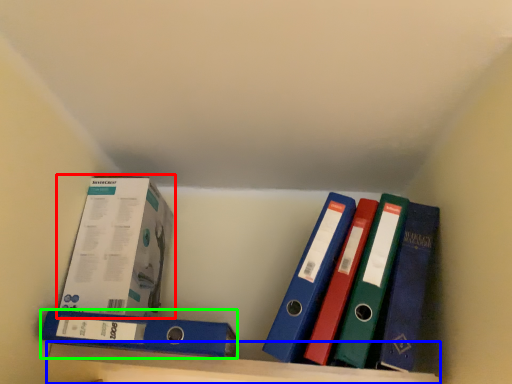
Question: Estimate the real-world distances between objects in this image. Which object is closer to box (highlighted by a red box), shelf (highlighted by a blue box) or binder (highlighted by a green box)?

Choices:
 (A) shelf
 (B) binder

Answer: (B)